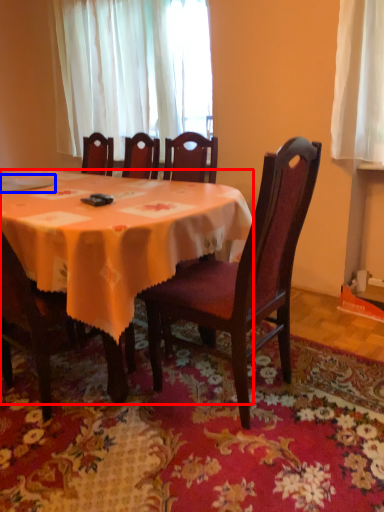
Question: Which point is further to the camera, kitchen & dining room table (highlighted by a red box) or tableware (highlighted by a blue box)?

Choices:
 (A) kitchen & dining room table
 (B) tableware

Answer: (B)